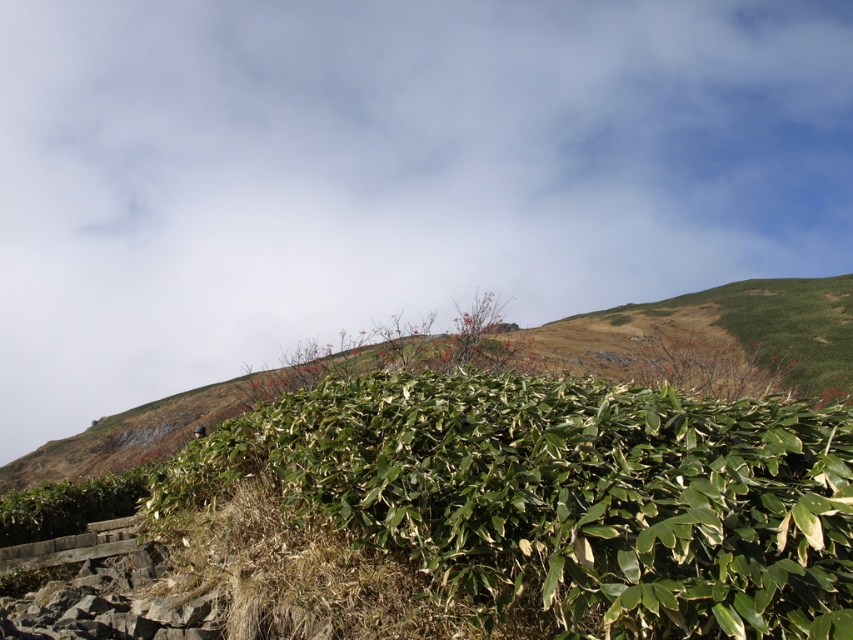
Question: Observing the image, what is the correct spatial positioning of white fluffy cloud at upper center in reference to green leafy bush at center?

Choices:
 (A) below
 (B) above

Answer: (B)

Question: Which of the following is the closest to the observer?

Choices:
 (A) white fluffy cloud at upper center
 (B) green leafy bush at center

Answer: (B)

Question: Can you confirm if white fluffy cloud at upper center is positioned to the left of green leafy bush at center?

Choices:
 (A) yes
 (B) no

Answer: (B)

Question: Which point is farther to the camera?

Choices:
 (A) white fluffy cloud at upper center
 (B) green leafy bush at center

Answer: (A)

Question: Is white fluffy cloud at upper center bigger than green leafy bush at center?

Choices:
 (A) yes
 (B) no

Answer: (A)